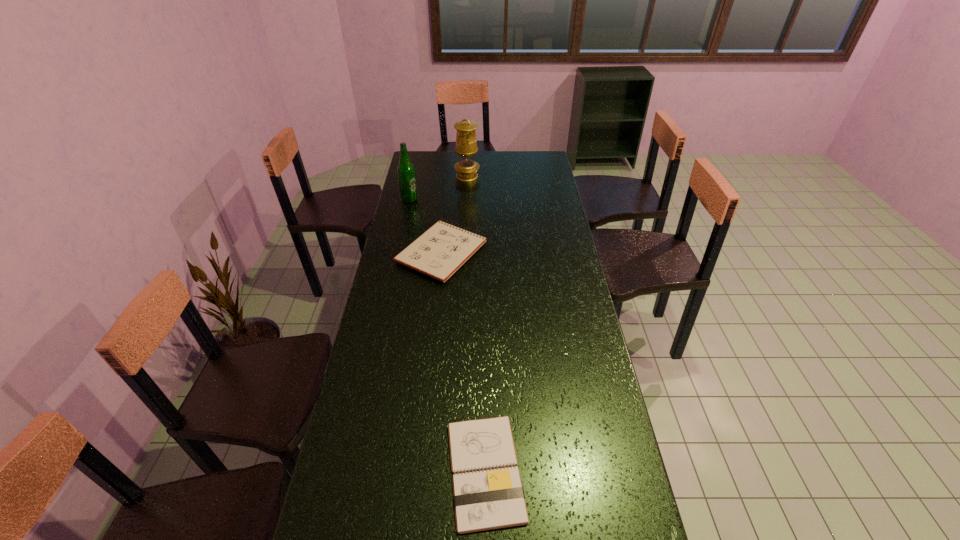
Image resolution: width=960 pixels, height=540 pixels. Find the location of `oil lamp`. oil lamp is located at coordinates (466, 145).

This screenshot has width=960, height=540. What are the coordinates of `beer bottle` in the screenshot? It's located at (406, 172).

Locate an element on the screen. the farther notepad is located at coordinates (439, 252).

Find the location of a particular element. the taller notepad is located at coordinates (439, 252).

I want to click on the shorter notepad, so click(x=490, y=499).

I want to click on the shortest object, so click(x=490, y=499).

Identify the location of free space located 0.090m on the back of the farthest object. The width and height of the screenshot is (960, 540). (468, 162).

The height and width of the screenshot is (540, 960). I want to click on free region located on the label of the third nearest object, so pos(500,199).

Find the location of a particular element. The image size is (960, 540). free location located 0.280m on the right of the second shortest object is located at coordinates (556, 252).

At what (x,y) coordinates should I click in order to perform the action: click on free space located on the back of the shorter notepad. Please return your answer as a coordinate pair (x, y). The height and width of the screenshot is (540, 960). Looking at the image, I should click on (484, 342).